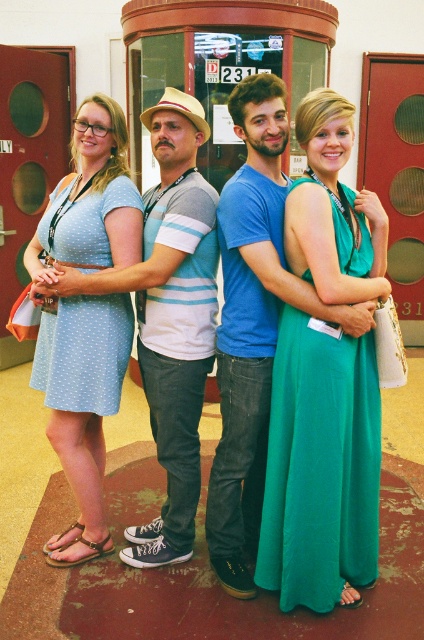
You are a photographer adjusting the lighting for a group photo. You notice two light blue dresses in the scene. Which one has a wider silhouette? The options are the light blue dotted dress at left and the light blue dotted fabric dress at left.

The light blue dotted dress at left has a wider silhouette than the light blue dotted fabric dress at left according to the description.